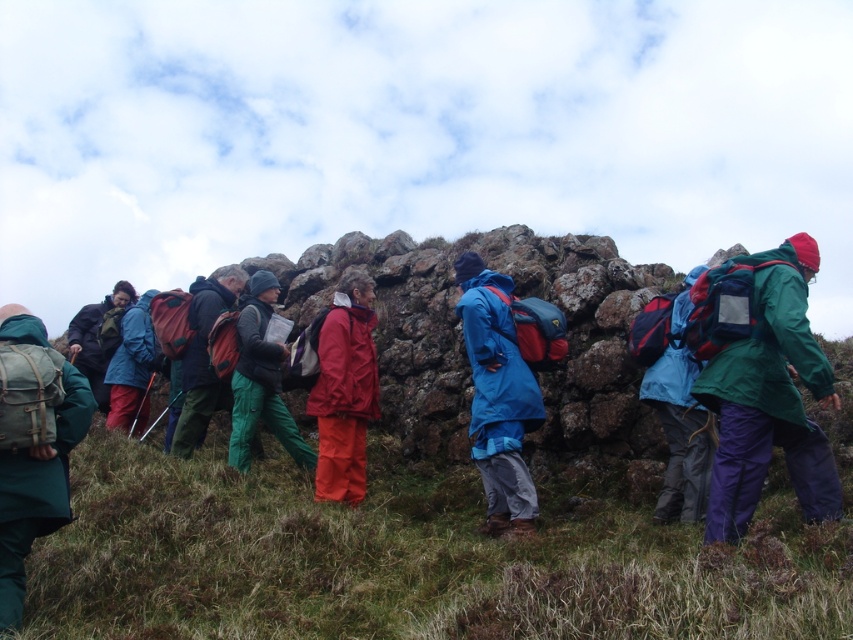
You are part of a hiking group and need to locate two hikers wearing jackets. The green matte jacket at center and the blue matte jacket at center are both in the center area. Which hiker is positioned to the right when viewed from your perspective?

The green matte jacket at center is to the right of the blue matte jacket at center, so the hiker wearing the green matte jacket at center is positioned to the right.

You are a hiker looking at the image and notice the matte red pants at center and the green fabric jacket at center. Which clothing item is positioned lower in the image?

The matte red pants at center is located below the green fabric jacket at center, so the matte red pants at center is positioned lower in the image.

You are a hiker who wants to determine which piece of clothing is higher up in the scene between the matte red pants at center and the green fabric jacket at center. Based on the scene description, which one is positioned higher?

The matte red pants at center is much taller than the green fabric jacket at center, so the matte red pants at center is positioned higher.